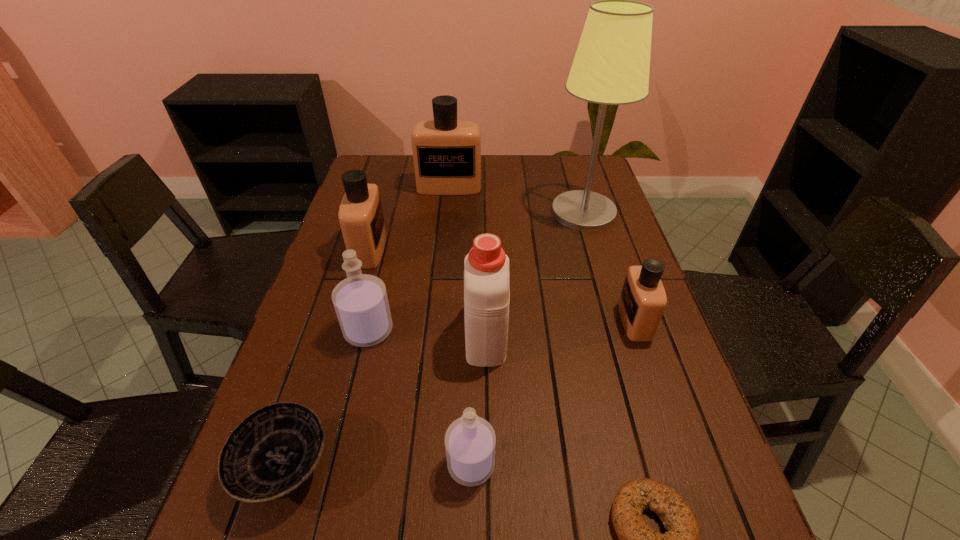
What are the coordinates of `the smaller purple perfume` in the screenshot? It's located at (470, 441).

Find the location of a particular element. Image resolution: width=960 pixels, height=540 pixels. the nearer purple perfume is located at coordinates (470, 441).

Identify the location of bowl. (272, 453).

At what (x,y) coordinates should I click in order to perform the action: click on vacant region located on the left of the tallest object. Please return your answer as a coordinate pair (x, y). Looking at the image, I should click on [465, 212].

You are a GUI agent. You are given a task and a screenshot of the screen. Output one action in this format:
    pyautogui.click(x=<x>, y=<y>)
    Task: Click on the free region located on the front label of the biggest beige perfume
    This screenshot has height=540, width=960.
    Given the screenshot: What is the action you would take?
    pyautogui.click(x=445, y=228)

What are the coordinates of `blank space located on the handle side of the white detergent` in the screenshot? It's located at (485, 218).

Where is `vacant space positioned 0.180m on the handle side of the white detergent`? The width and height of the screenshot is (960, 540). vacant space positioned 0.180m on the handle side of the white detergent is located at coordinates (485, 258).

You are a GUI agent. You are given a task and a screenshot of the screen. Output one action in this format:
    pyautogui.click(x=<x>, y=<y>)
    Task: Click on the vacant space located 0.400m on the handle side of the white detergent
    
    Given the screenshot: What is the action you would take?
    pyautogui.click(x=484, y=213)

Locate an element on the screen. vacant space located on the front of the bigger purple perfume is located at coordinates (334, 474).

Where is `vacant space located 0.180m on the front label of the second nearest beige perfume`? The height and width of the screenshot is (540, 960). vacant space located 0.180m on the front label of the second nearest beige perfume is located at coordinates (447, 249).